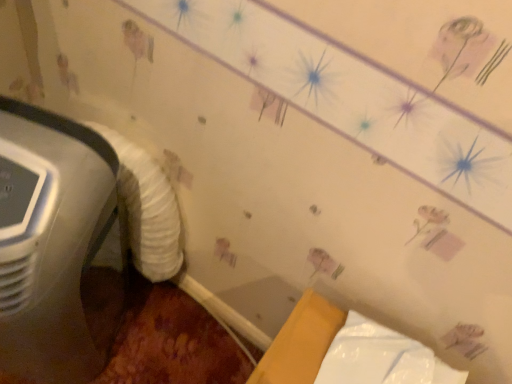
Question: Is white glossy wrapping paper at lower right to the right of white fluffy sheet at left from the viewer's perspective?

Choices:
 (A) yes
 (B) no

Answer: (A)

Question: Is white glossy wrapping paper at lower right oriented away from white fluffy sheet at left?

Choices:
 (A) no
 (B) yes

Answer: (A)

Question: Is white glossy wrapping paper at lower right with white fluffy sheet at left?

Choices:
 (A) no
 (B) yes

Answer: (A)

Question: Is white glossy wrapping paper at lower right at the left side of white fluffy sheet at left?

Choices:
 (A) yes
 (B) no

Answer: (B)

Question: Is white glossy wrapping paper at lower right taller than white fluffy sheet at left?

Choices:
 (A) no
 (B) yes

Answer: (A)

Question: Can you confirm if white glossy wrapping paper at lower right is bigger than white fluffy sheet at left?

Choices:
 (A) yes
 (B) no

Answer: (A)

Question: From a real-world perspective, is white fluffy sheet at left over white plastic air conditioner at left?

Choices:
 (A) no
 (B) yes

Answer: (B)

Question: Considering the relative sizes of white fluffy sheet at left and white plastic air conditioner at left in the image provided, is white fluffy sheet at left thinner than white plastic air conditioner at left?

Choices:
 (A) no
 (B) yes

Answer: (B)

Question: Is the position of white fluffy sheet at left less distant than that of white plastic air conditioner at left?

Choices:
 (A) no
 (B) yes

Answer: (A)

Question: Is white plastic air conditioner at left at the back of white fluffy sheet at left?

Choices:
 (A) no
 (B) yes

Answer: (B)

Question: Is white plastic air conditioner at left surrounded by white fluffy sheet at left?

Choices:
 (A) yes
 (B) no

Answer: (B)

Question: Can you confirm if white fluffy sheet at left is bigger than white plastic air conditioner at left?

Choices:
 (A) yes
 (B) no

Answer: (B)

Question: From the image's perspective, is white plastic air conditioner at left under white glossy wrapping paper at lower right?

Choices:
 (A) yes
 (B) no

Answer: (B)